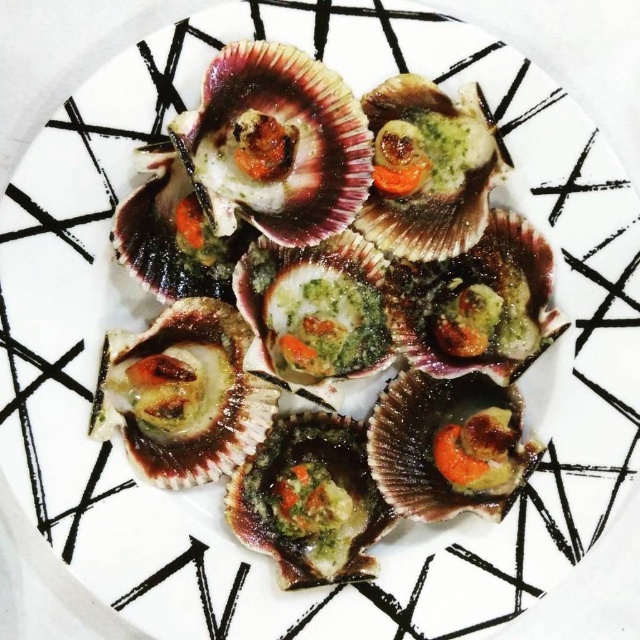
Can you confirm if green matte scallop at center is positioned below shiny brown shellfish at center?

Incorrect, green matte scallop at center is not positioned below shiny brown shellfish at center.

Does point (156, 381) come farther from viewer compared to point (280, 483)?

No, (156, 381) is closer to viewer.

This screenshot has height=640, width=640. What do you see at coordinates (182, 394) in the screenshot?
I see `green matte scallop at center` at bounding box center [182, 394].

At what (x,y) coordinates should I click in order to perform the action: click on green matte scallop at center. Please return your answer as a coordinate pair (x, y). This screenshot has height=640, width=640. Looking at the image, I should click on (182, 394).